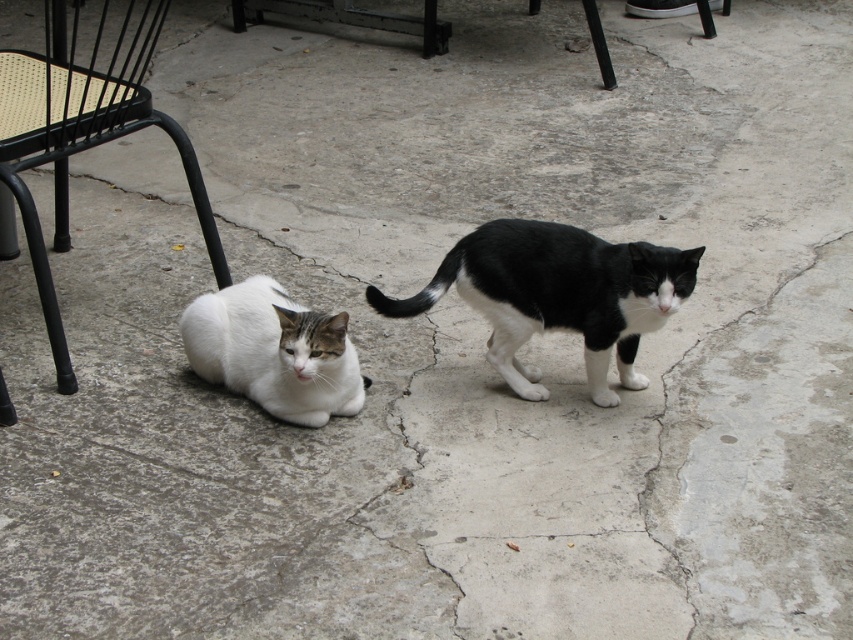
Question: From the image, what is the correct spatial relationship of black metal chair at left in relation to white fur cat at lower left?

Choices:
 (A) right
 (B) left

Answer: (B)

Question: Considering the real-world distances, which object is closest to the white fur cat at lower left?

Choices:
 (A) black metal chair at left
 (B) black/white fur cat at center

Answer: (B)

Question: Is black metal chair at left further to camera compared to white fur cat at lower left?

Choices:
 (A) no
 (B) yes

Answer: (B)

Question: Based on their relative distances, which object is nearer to the black/white fur cat at center?

Choices:
 (A) white fur cat at lower left
 (B) black metal chair at left

Answer: (A)

Question: Which object is farther from the camera taking this photo?

Choices:
 (A) black/white fur cat at center
 (B) white fur cat at lower left

Answer: (B)

Question: Does black metal chair at left lie in front of white fur cat at lower left?

Choices:
 (A) yes
 (B) no

Answer: (B)